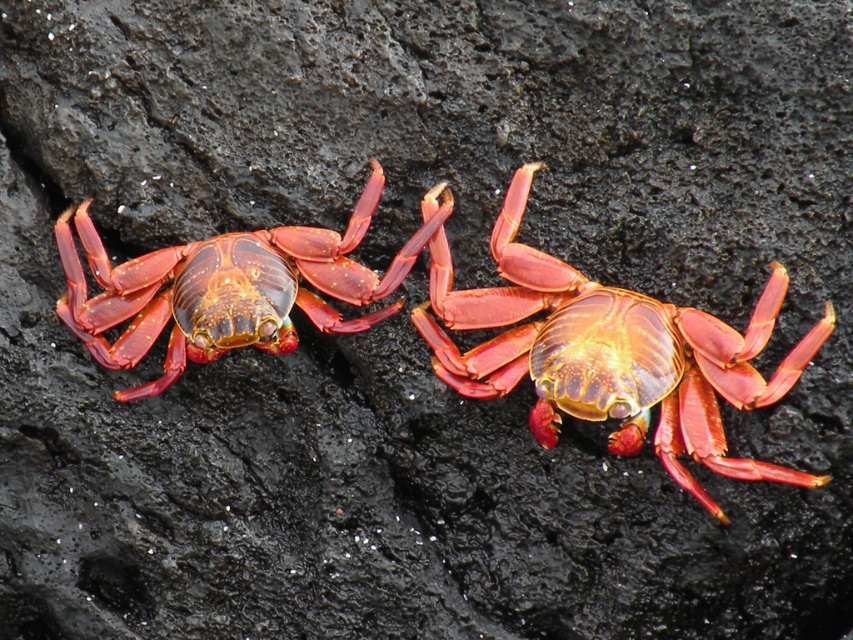
Does shiny red crab at center have a greater height compared to shiny red crab at left?

Correct, shiny red crab at center is much taller as shiny red crab at left.

Is point (518, 186) behind point (160, 392)?

No, it is in front of (160, 392).

Is point (653, 326) positioned after point (248, 272)?

No, (653, 326) is in front of (248, 272).

You are a GUI agent. You are given a task and a screenshot of the screen. Output one action in this format:
    pyautogui.click(x=<x>, y=<y>)
    Task: Click on the shiny red crab at center
    
    Given the screenshot: What is the action you would take?
    tap(611, 353)